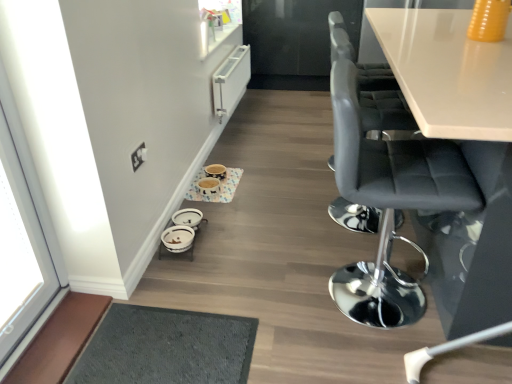
Where is `empty space that is ontop of matte ceramic bowls at center, the first round table positioned from the back (from a real-world perspective)`? The image size is (512, 384). empty space that is ontop of matte ceramic bowls at center, the first round table positioned from the back (from a real-world perspective) is located at coordinates tap(219, 178).